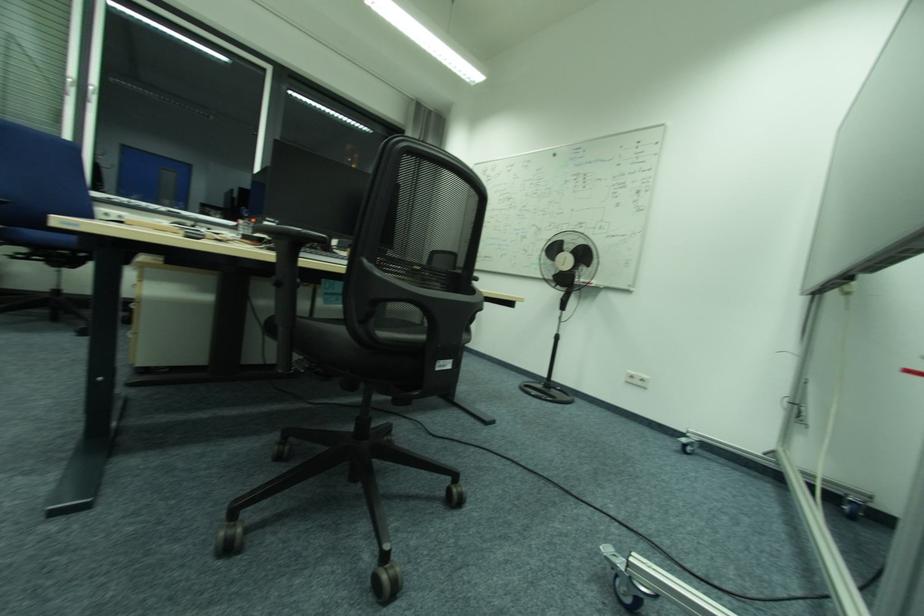
Describe the element at coordinates (292, 235) in the screenshot. The height and width of the screenshot is (616, 924). I see `a black chair armrest` at that location.